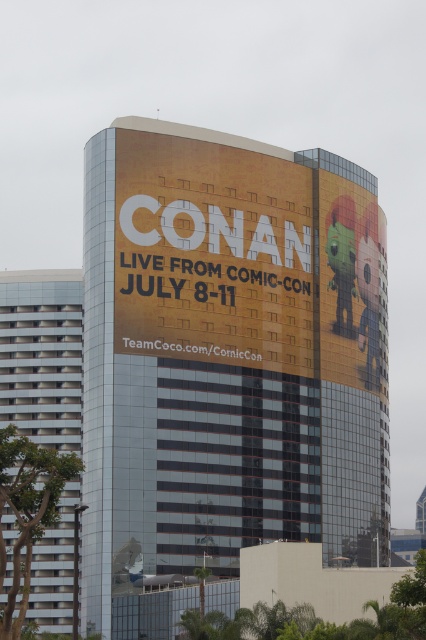
Between yellow matte sign at center and white glass windows at left, which one has more height?

white glass windows at left is taller.

Between yellow matte sign at center and white glass windows at left, which one appears on the left side from the viewer's perspective?

white glass windows at left

The image size is (426, 640). Describe the element at coordinates (250, 259) in the screenshot. I see `yellow matte sign at center` at that location.

Find the location of a particular element. The width and height of the screenshot is (426, 640). yellow matte sign at center is located at coordinates (250, 259).